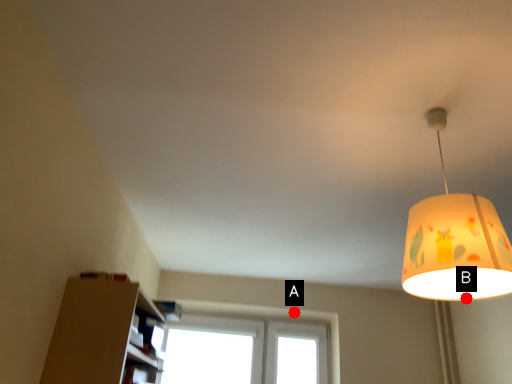
Question: Two points are circled on the image, labeled by A and B beside each circle. Which point is farther to the camera?

Choices:
 (A) A is further
 (B) B is further

Answer: (A)